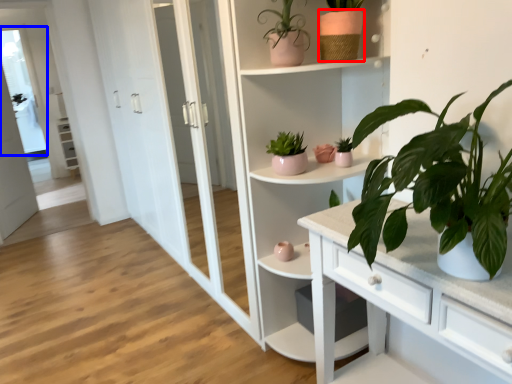
Question: Which object appears closest to the camera in this image, flowerpot (highlighted by a red box) or window (highlighted by a blue box)?

Choices:
 (A) flowerpot
 (B) window

Answer: (A)